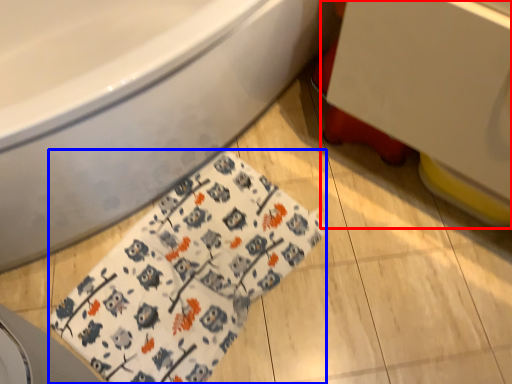
Question: Which point is closer to the camera, sink (highlighted by a red box) or blanket (highlighted by a blue box)?

Choices:
 (A) sink
 (B) blanket

Answer: (A)